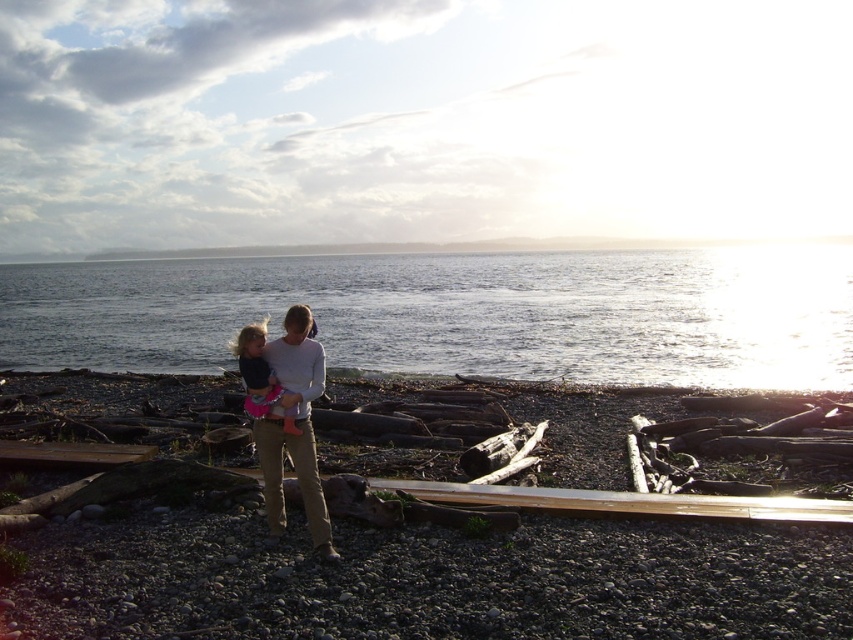
You are a photographer planning to capture the clear water at center and the matte pink skirt at center in a single frame. Based on their positions, which object will appear larger in the photo?

The clear water at center will appear larger in the photo because it is much taller than the matte pink skirt at center.

You are standing on the beach and see the clear water at center and the matte pink skirt at center. Which object is closer to you?

The clear water at center is closer to you because it is further to the viewer than the matte pink skirt at center.

You are standing on the rocky beach and see the light gray cotton sweater at center and the matte pink skirt at center. Which item is closer to you?

The light gray cotton sweater at center is closer to you because it is in front of the matte pink skirt at center.